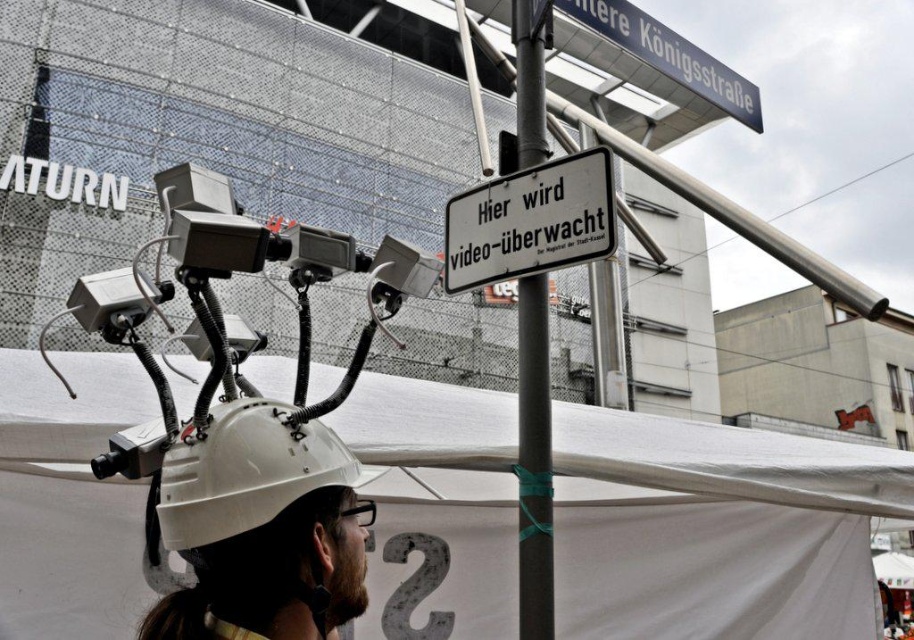
You are a delivery person trying to navigate through the area shown in the image. You need to deliver a package to the white fabric tent at center. From your current position, which direction should you move relative to the silver metallic cameras at upper center to reach the tent?

The white fabric tent at center is located below the silver metallic cameras at upper center, so you should move downward from the silver metallic cameras at upper center to reach the tent.

You are navigating through the urban setting shown in the image. You need to move from the point at coordinates point (541, 230) to the point at coordinates point (644, 42). Which direction should you move in to reach your destination?

To move from point (541, 230) to point (644, 42), you should move towards the left and slightly upwards since point (644, 42) is behind point (541, 230) and located to the left and above it.